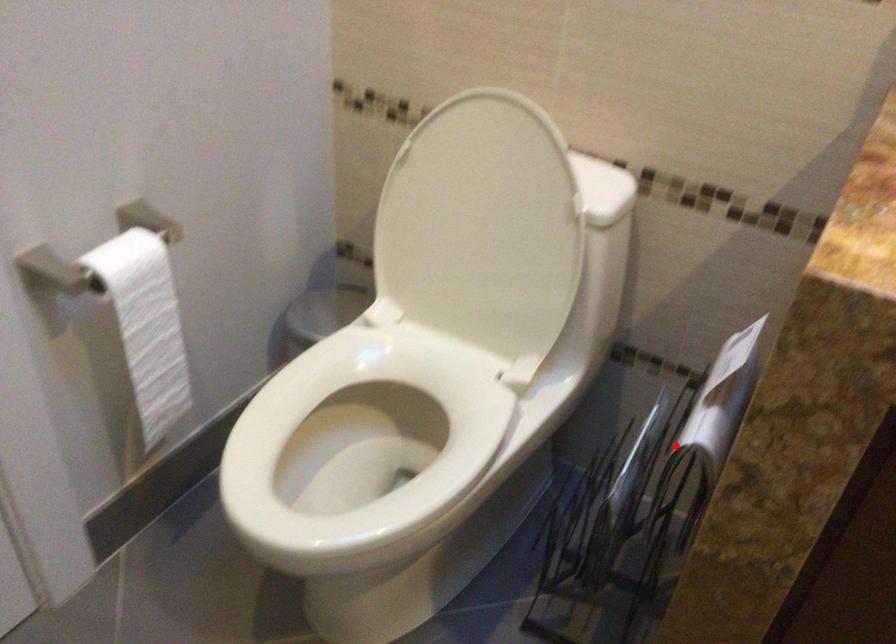
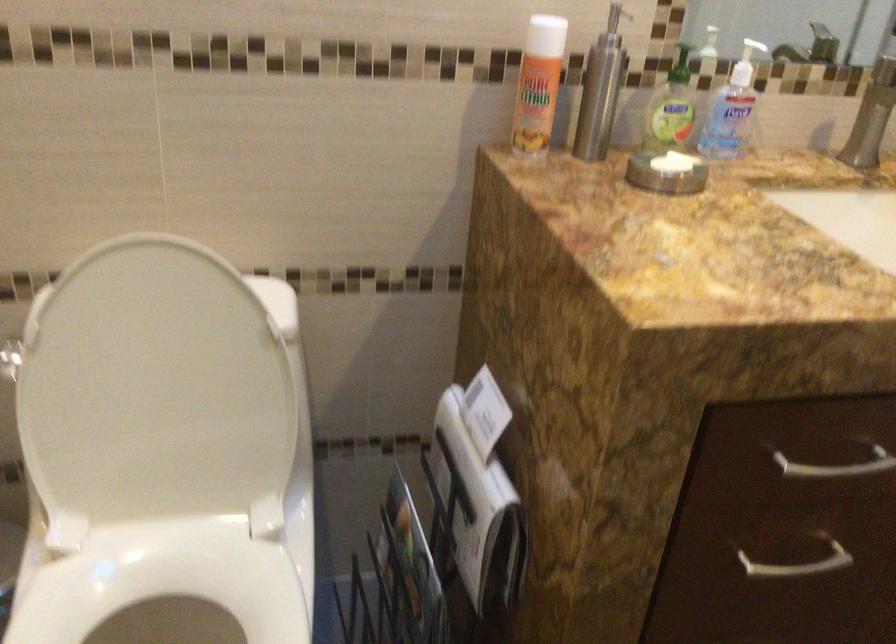
In the second image, find the point that corresponds to the highlighted location in the first image.

(477, 512)